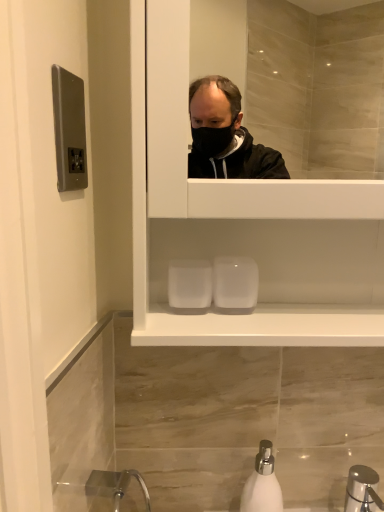
Question: Is satin nickel switchplate at upper left shorter than white matte soap dispenser at lower center?

Choices:
 (A) no
 (B) yes

Answer: (B)

Question: Is satin nickel switchplate at upper left oriented away from white matte soap dispenser at lower center?

Choices:
 (A) no
 (B) yes

Answer: (A)

Question: From the image's perspective, is satin nickel switchplate at upper left over white matte soap dispenser at lower center?

Choices:
 (A) yes
 (B) no

Answer: (A)

Question: Could you tell me if satin nickel switchplate at upper left is turned towards white matte soap dispenser at lower center?

Choices:
 (A) no
 (B) yes

Answer: (A)

Question: Is satin nickel switchplate at upper left thinner than white matte soap dispenser at lower center?

Choices:
 (A) yes
 (B) no

Answer: (A)

Question: Would you say satin nickel switchplate at upper left is a long distance from white matte soap dispenser at lower center?

Choices:
 (A) no
 (B) yes

Answer: (A)

Question: Is white matte soap dispenser at lower center looking in the opposite direction of satin nickel switchplate at upper left?

Choices:
 (A) no
 (B) yes

Answer: (A)

Question: Does white matte soap dispenser at lower center appear on the left side of satin nickel switchplate at upper left?

Choices:
 (A) no
 (B) yes

Answer: (A)

Question: Is white matte soap dispenser at lower center located outside satin nickel switchplate at upper left?

Choices:
 (A) no
 (B) yes

Answer: (B)

Question: Is white matte soap dispenser at lower center smaller than satin nickel switchplate at upper left?

Choices:
 (A) no
 (B) yes

Answer: (A)

Question: Considering the relative positions of white matte soap dispenser at lower center and satin nickel switchplate at upper left in the image provided, is white matte soap dispenser at lower center in front of satin nickel switchplate at upper left?

Choices:
 (A) yes
 (B) no

Answer: (B)

Question: From the image's perspective, is white matte soap dispenser at lower center above satin nickel switchplate at upper left?

Choices:
 (A) yes
 (B) no

Answer: (B)

Question: Visually, is satin nickel switchplate at upper left positioned to the left or to the right of white matte soap dispenser at lower center?

Choices:
 (A) left
 (B) right

Answer: (A)